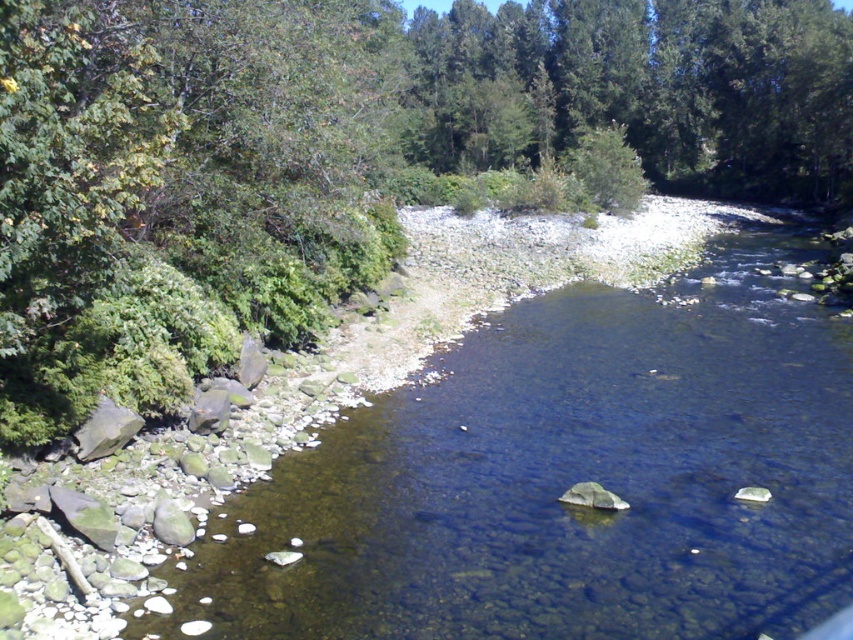
You are planning to cross the river using a small wooden bridge that can only support a path as narrow as the clear water at river center. Will the bridge be wide enough to span the green leafy trees at upper center?

The clear water at river center is narrower than the green leafy trees at upper center. Since the bridge can only support the width of the clear water at river center, it will not be wide enough to span the green leafy trees at upper center.

You are planning to build a small wooden bridge that is 40 meters long over the clear water at river center. The green leafy tree at upper left is in the way. Can you build the bridge without cutting down the tree?

The distance between the green leafy tree at upper left and the clear water at river center is 39.96 meters. Since the bridge is 40 meters long, it would require cutting down the tree to fit the bridge over the clear water at river center.

In the serene natural scene, there is a green leafy tree at upper left and green leafy trees at upper center. Which of these objects is larger in size?

The green leafy tree at upper left is bigger than the green leafy trees at upper center.